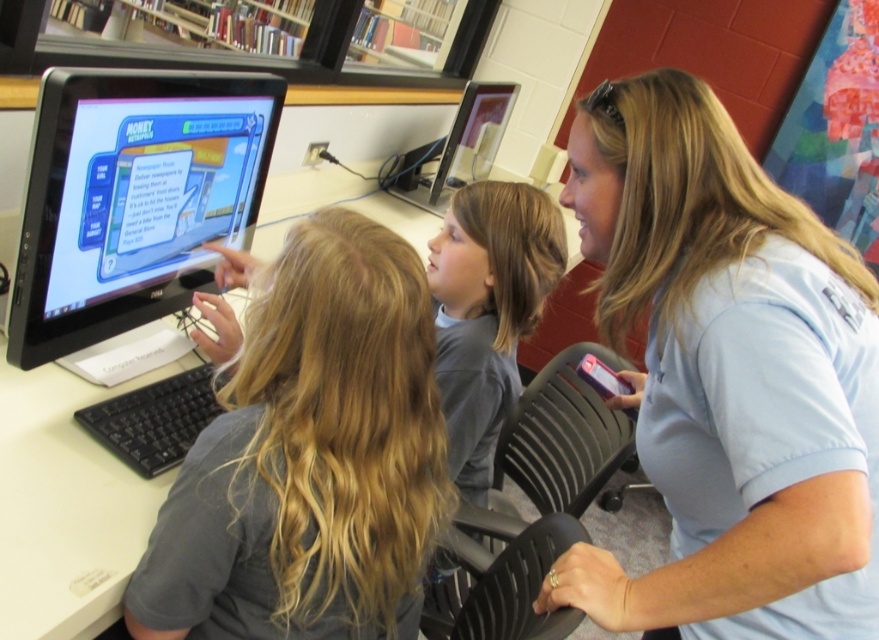
Can you confirm if gray shirt at center is bigger than matte black monitor at upper center?

Correct, gray shirt at center is larger in size than matte black monitor at upper center.

Is gray shirt at center behind matte black monitor at upper center?

No.

I want to click on gray shirt at center, so click(488, 310).

At what (x,y) coordinates should I click in order to perform the action: click on gray shirt at center. Please return your answer as a coordinate pair (x, y). Image resolution: width=879 pixels, height=640 pixels. Looking at the image, I should click on (488, 310).

Between point (236, 84) and point (436, 202), which one is positioned behind?

The point (436, 202) is behind.

Does point (184, 182) come closer to viewer compared to point (456, 164)?

Yes, it is in front of point (456, 164).

Image resolution: width=879 pixels, height=640 pixels. What are the coordinates of `matte black monitor at left` in the screenshot? It's located at tap(132, 196).

Which is behind, point (344, 412) or point (442, 150)?

The point (442, 150) is behind.

Which is in front, point (180, 563) or point (503, 113)?

Point (180, 563)

You are a GUI agent. You are given a task and a screenshot of the screen. Output one action in this format:
    pyautogui.click(x=<x>, y=<y>)
    Task: Click on the gray matte shirt at center
    
    Given the screenshot: What is the action you would take?
    (x=310, y=458)